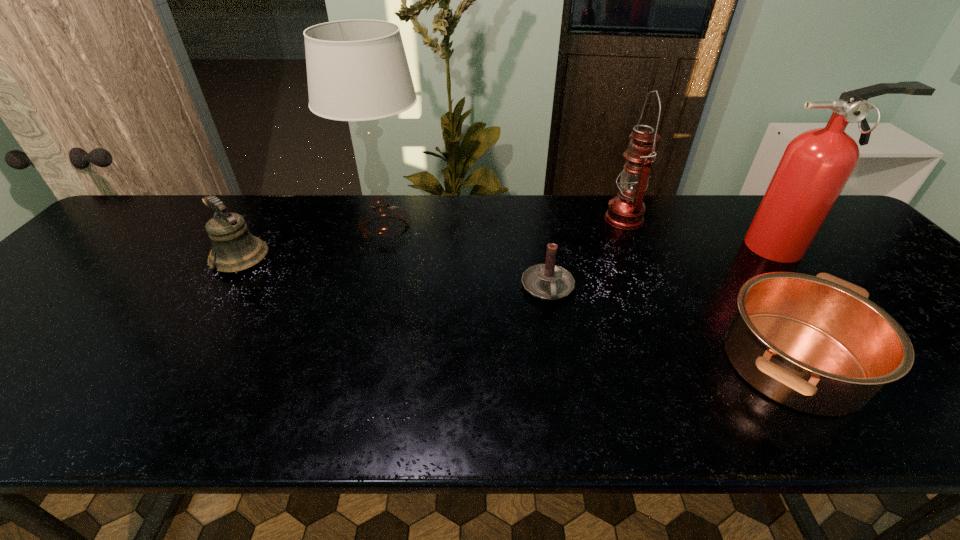
I want to click on free space located 0.100m on the right of the oil lamp, so (676, 219).

This screenshot has height=540, width=960. Find the location of `free spot located 0.160m on the right of the fourth tallest object`. free spot located 0.160m on the right of the fourth tallest object is located at coordinates (329, 260).

This screenshot has width=960, height=540. Identify the location of free space located on the side of the fourth object from right to left with the handle loop. (562, 368).

In order to click on vacant space located 0.220m on the back of the saucepan in this screenshot , I will do `click(718, 251)`.

Where is `table lamp at the far edge`? table lamp at the far edge is located at coordinates (357, 70).

Find the location of a particular element. The width and height of the screenshot is (960, 540). fire extinguisher that is positioned at the far edge is located at coordinates (816, 165).

Where is `oil lamp that is at the far edge`? The width and height of the screenshot is (960, 540). oil lamp that is at the far edge is located at coordinates (626, 211).

Image resolution: width=960 pixels, height=540 pixels. Find the location of `object that is positioned at the near edge`. object that is positioned at the near edge is located at coordinates (816, 344).

At what (x,y) coordinates should I click in order to perform the action: click on object situated at the right edge. Please return your answer as a coordinate pair (x, y). Looking at the image, I should click on (816, 165).

Image resolution: width=960 pixels, height=540 pixels. Identify the location of object positioned at the far right corner. (816, 165).